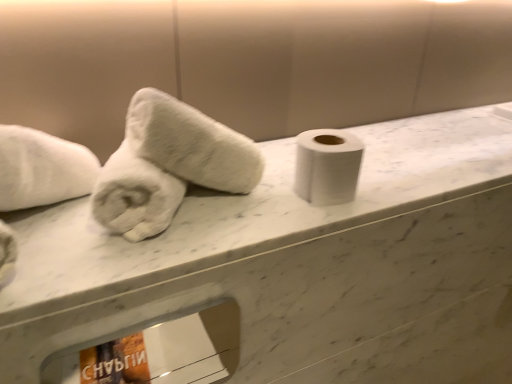
Locate an element on the screen. The width and height of the screenshot is (512, 384). free space in front of white fluffy towel at left, the 1th towel in the right-to-left sequence is located at coordinates (164, 243).